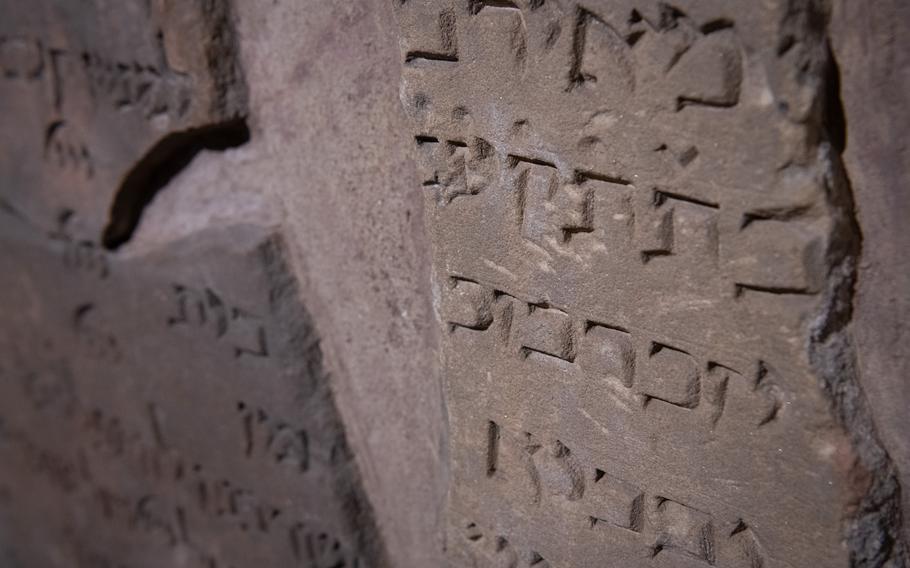
Find the location of a particular element. raised ledge is located at coordinates (288, 293).